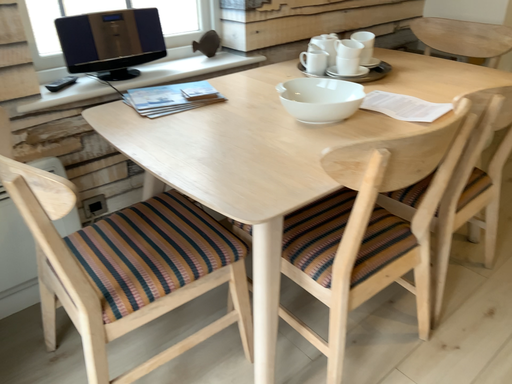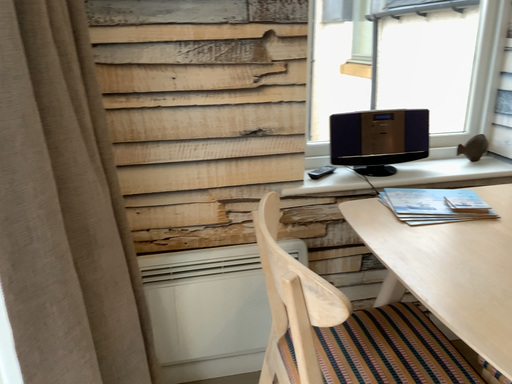
Question: How did the camera likely rotate when shooting the video?

Choices:
 (A) rotated left
 (B) rotated right

Answer: (A)